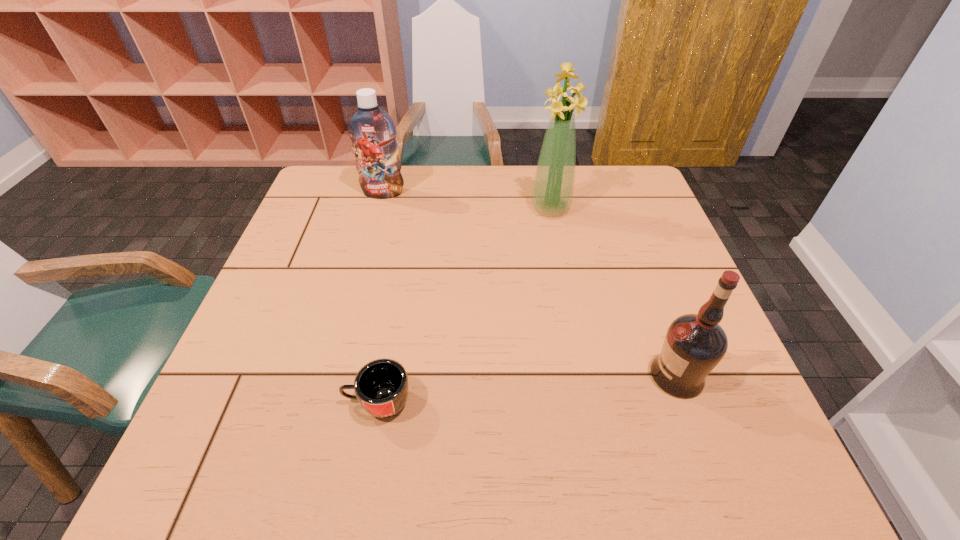
Locate an element on the screen. Image resolution: width=960 pixels, height=540 pixels. the tallest object is located at coordinates (553, 186).

Find the location of a particular element. bouquet is located at coordinates (553, 186).

Where is `shampoo`? This screenshot has height=540, width=960. shampoo is located at coordinates (372, 131).

Identify the location of the rightmost object. (694, 344).

This screenshot has height=540, width=960. I want to click on the shortest object, so click(x=381, y=386).

Locate an element on the screen. The image size is (960, 540). vacant space situated 0.080m on the front-facing side of the tallest object is located at coordinates click(x=556, y=239).

You are a GUI agent. You are given a task and a screenshot of the screen. Output one action in this format:
    pyautogui.click(x=<x>, y=<y>)
    Task: Click on the free space located on the front label of the shampoo
    Image resolution: width=960 pixels, height=540 pixels.
    Given the screenshot: What is the action you would take?
    pyautogui.click(x=376, y=218)

Locate an element on the screen. Image resolution: width=960 pixels, height=540 pixels. free point located on the surface of the liquor is located at coordinates (541, 376).

Find the location of a particular element. The height and width of the screenshot is (540, 960). blank area located on the surface of the liquor is located at coordinates (612, 376).

This screenshot has height=540, width=960. Find the location of `free space located on the surface of the liquor`. free space located on the surface of the liquor is located at coordinates [557, 376].